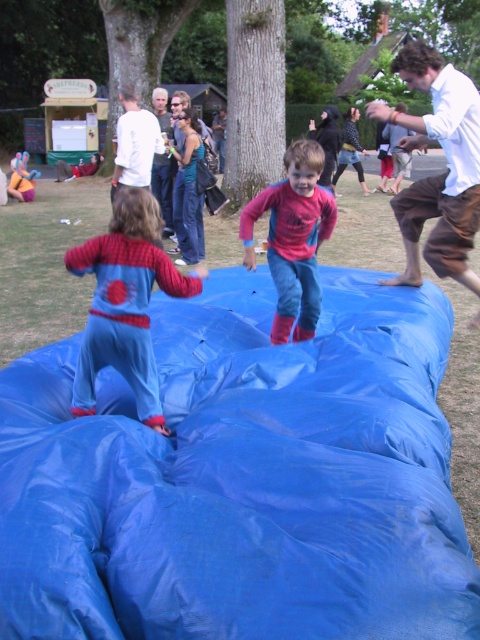
You are standing at the center of the image and want to place a blue rubber mat at point (x=241, y=477). Is there enough space to place it there?

The blue rubber mat at center is already placed at point (x=241, y=477), so there is no space to place another one there.